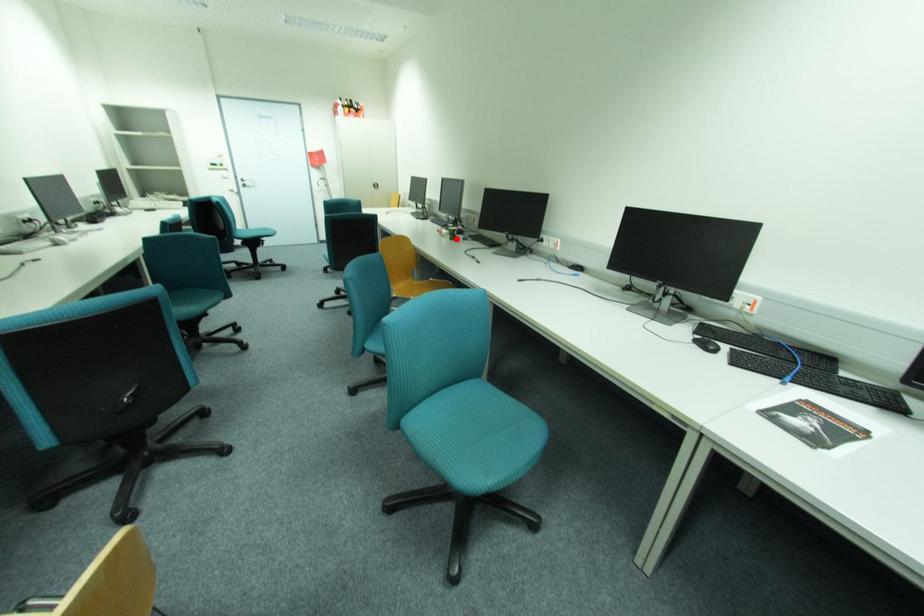
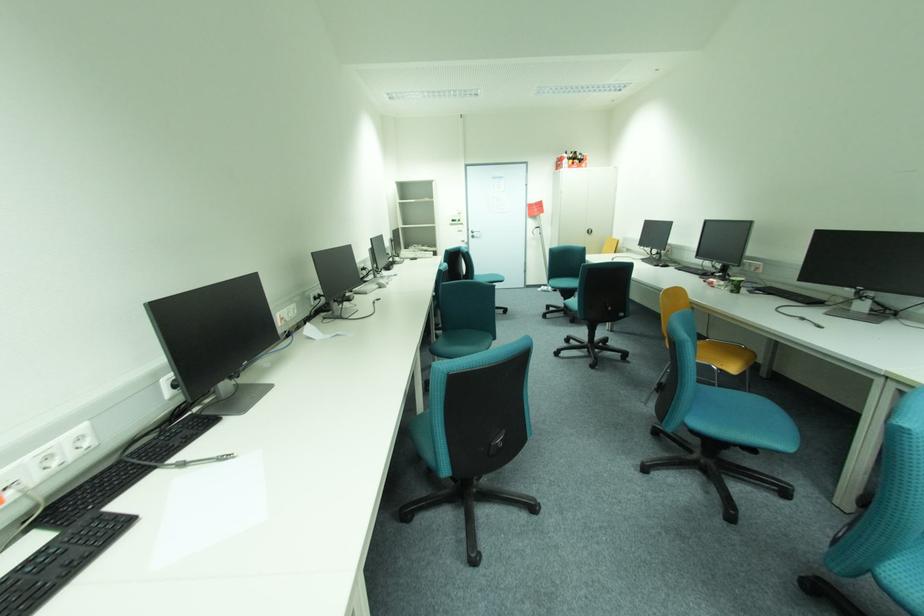
Find the pixel in the second image that matches the highlighted location in the first image.

(738, 292)